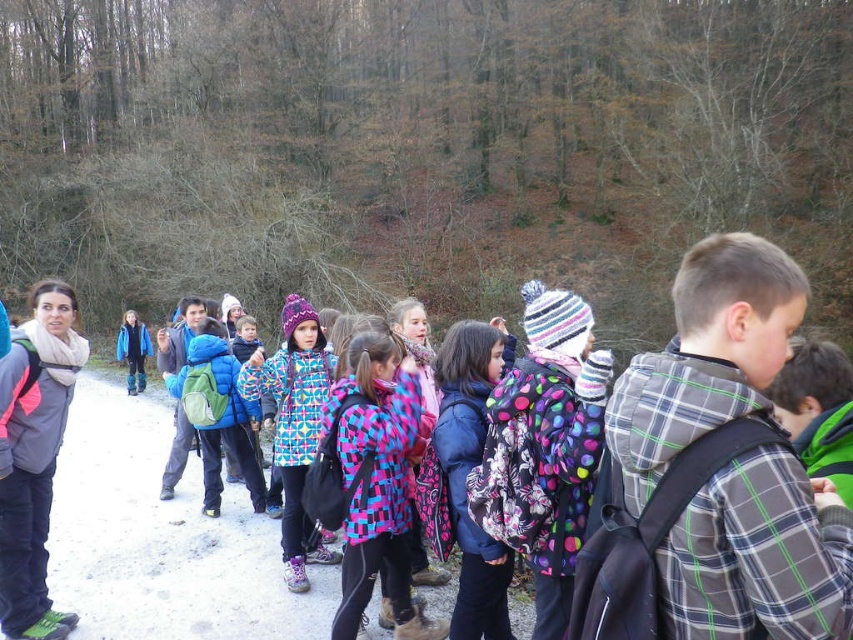
Does polka dot scarf at center appear under multicolored quilted jacket at center?

Correct, polka dot scarf at center is located below multicolored quilted jacket at center.

Which is behind, point (503, 605) or point (294, 388)?

Point (294, 388)

Which is behind, point (508, 358) or point (273, 397)?

The point (273, 397) is more distant.

This screenshot has width=853, height=640. In order to click on polka dot scarf at center in this screenshot , I will do `click(469, 468)`.

Which is in front, point (392, 541) or point (469, 349)?

Point (469, 349) is more forward.

Is pink checkered jacket at center in front of polka dot scarf at center?

No, pink checkered jacket at center is behind polka dot scarf at center.

Is point (395, 628) positioned behind point (477, 408)?

Yes.

Where is `pink checkered jacket at center`? Image resolution: width=853 pixels, height=640 pixels. pink checkered jacket at center is located at coordinates (378, 481).

Which is more to the right, matte gray jacket at left or polka dot scarf at center?

polka dot scarf at center is more to the right.

Who is more forward, (16, 621) or (448, 339)?

Positioned in front is point (448, 339).

What are the coordinates of `matte gray jacket at left` in the screenshot? It's located at (33, 456).